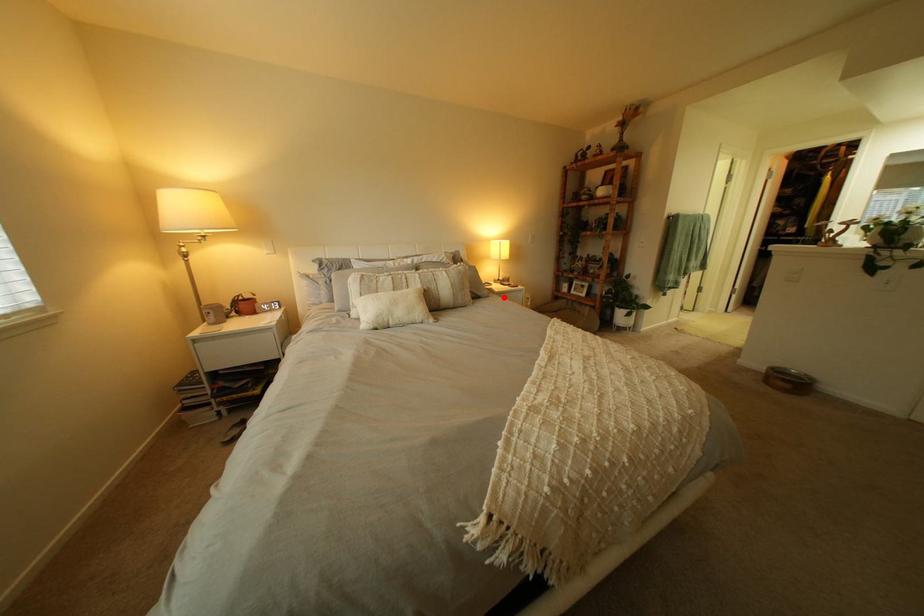
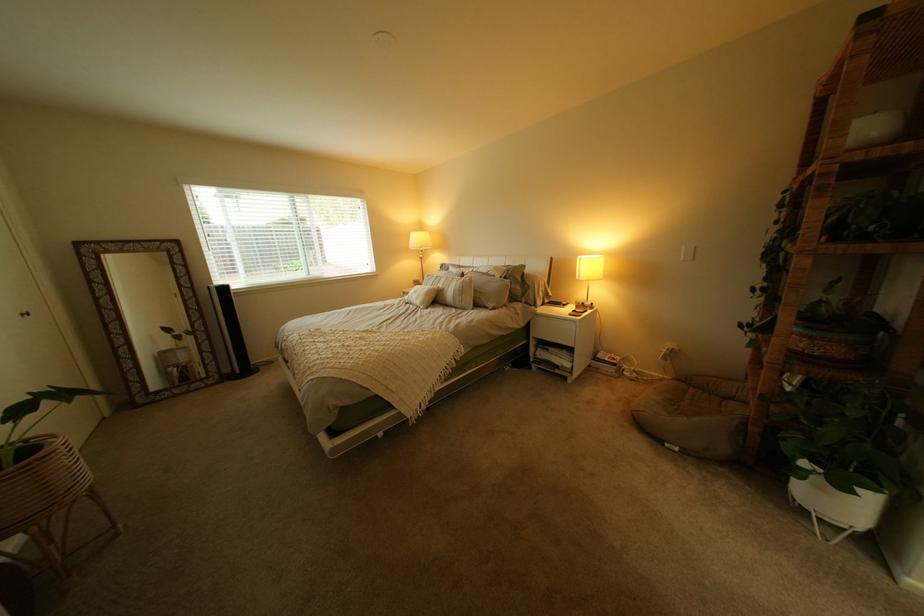
Question: I am providing you with two images of the same scene from different viewpoints. A red point is marked on the first image. Can you still see the location of the red point in image 2?

Choices:
 (A) Yes
 (B) No

Answer: (A)